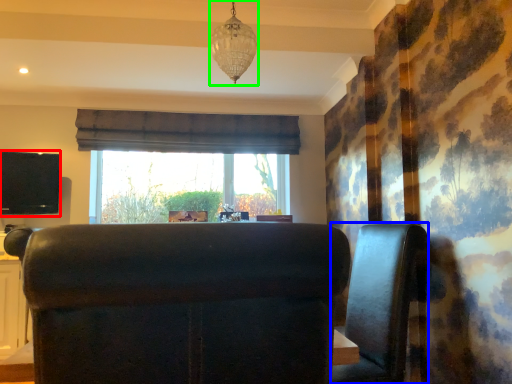
Question: Which object is positioned closest to wide (highlighted by a red box)? Select from furniture (highlighted by a blue box) and lamp (highlighted by a green box).

Choices:
 (A) furniture
 (B) lamp

Answer: (B)